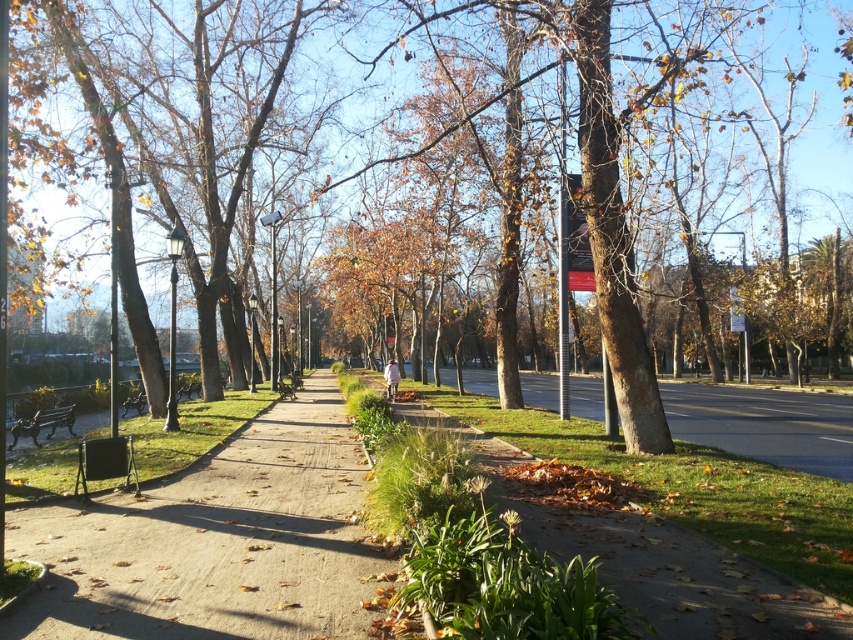
Is smooth concrete path at center further to the viewer compared to wooden bench at left?

No.

Who is higher up, smooth concrete path at center or wooden bench at left?

wooden bench at left is higher up.

Does point (68, 634) come behind point (33, 444)?

No, (68, 634) is in front of (33, 444).

In order to click on smooth concrete path at center in this screenshot , I will do `click(218, 541)`.

Is point (198, 385) positioned in front of point (123, 410)?

No.

Consider the image. Is the position of wooden park bench at center-left less distant than that of wooden park bench at left?

No, wooden park bench at center-left is behind wooden park bench at left.

Where is `wooden park bench at center-left`? The width and height of the screenshot is (853, 640). wooden park bench at center-left is located at coordinates (187, 387).

At what (x,y) coordinates should I click in order to perform the action: click on brown wood tree at center. Please return your answer as a coordinate pair (x, y). Looking at the image, I should click on (605, 188).

Who is taller, brown wood tree at center or wooden park bench at center-left?

brown wood tree at center

Where is `brown wood tree at center`? Image resolution: width=853 pixels, height=640 pixels. brown wood tree at center is located at coordinates (605, 188).

In order to click on brown wood tree at center in this screenshot , I will do `click(605, 188)`.